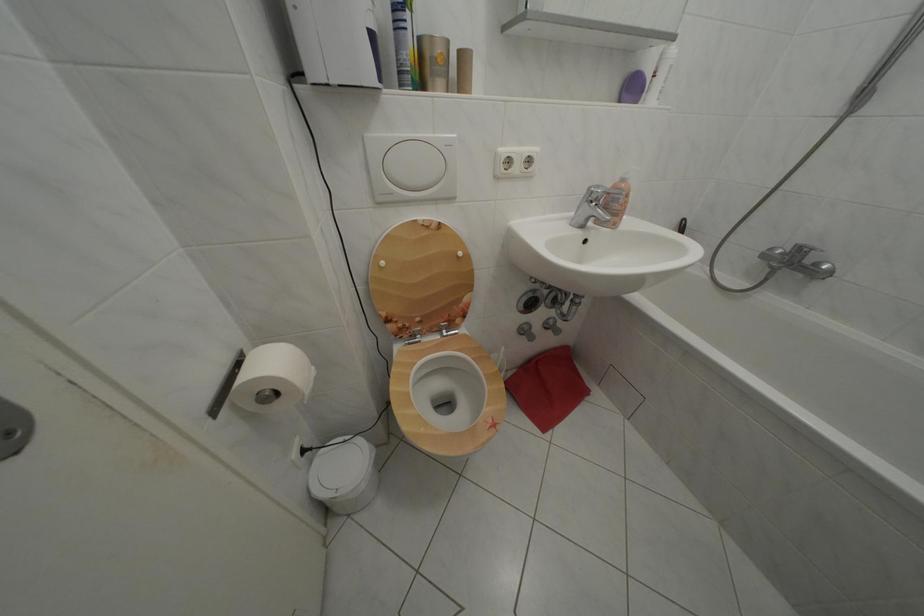
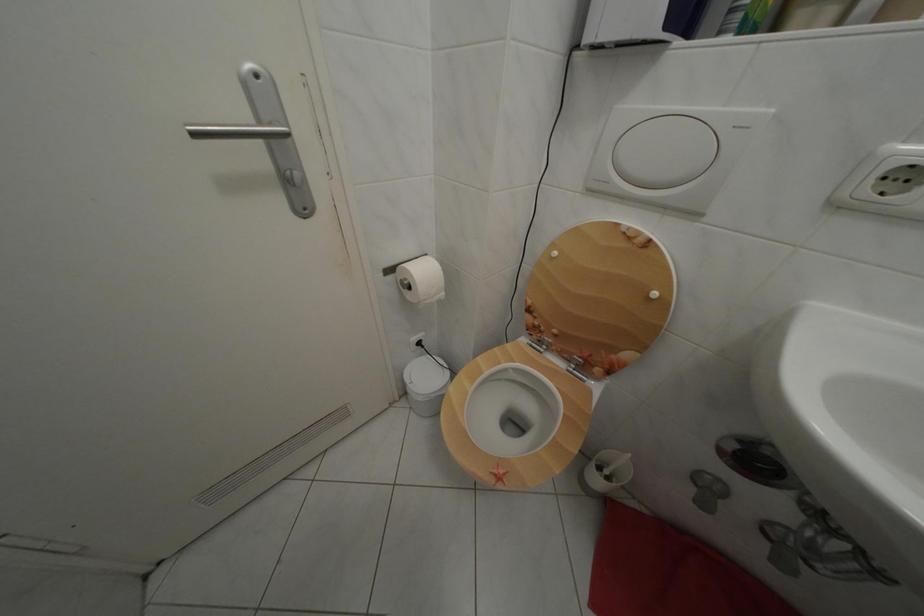
The images are taken continuously from a first-person perspective. In which direction is your viewpoint rotating?

The camera rotated toward left-down.